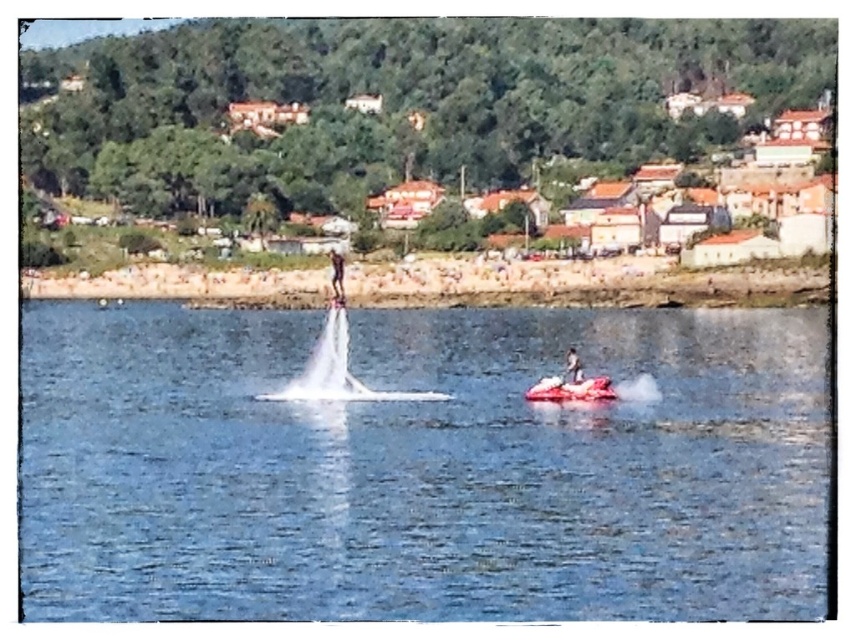
Question: Where is clear blue water at center located in relation to smooth skin person at upper center in the image?

Choices:
 (A) below
 (B) above

Answer: (A)

Question: Considering the real-world distances, which object is closest to the smooth white surfboard at center?

Choices:
 (A) smooth skin person at upper center
 (B) red rubber boat at center
 (C) clear blue water at center

Answer: (B)

Question: Which object appears closest to the camera in this image?

Choices:
 (A) clear blue water at center
 (B) red rubber boat at center
 (C) smooth white surfboard at center

Answer: (A)

Question: Observing the image, what is the correct spatial positioning of clear blue water at center in reference to smooth skin person at upper center?

Choices:
 (A) below
 (B) above

Answer: (A)

Question: Does smooth skin person at upper center have a smaller size compared to smooth white surfboard at center?

Choices:
 (A) no
 (B) yes

Answer: (A)

Question: Estimate the real-world distances between objects in this image. Which object is closer to the clear blue water at center?

Choices:
 (A) smooth white surfboard at center
 (B) red rubber boat at center

Answer: (A)